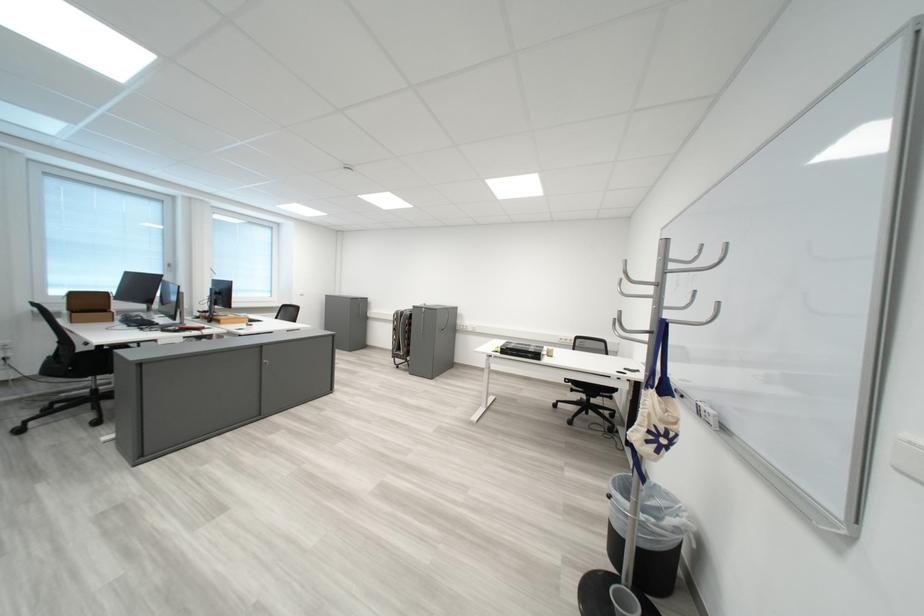
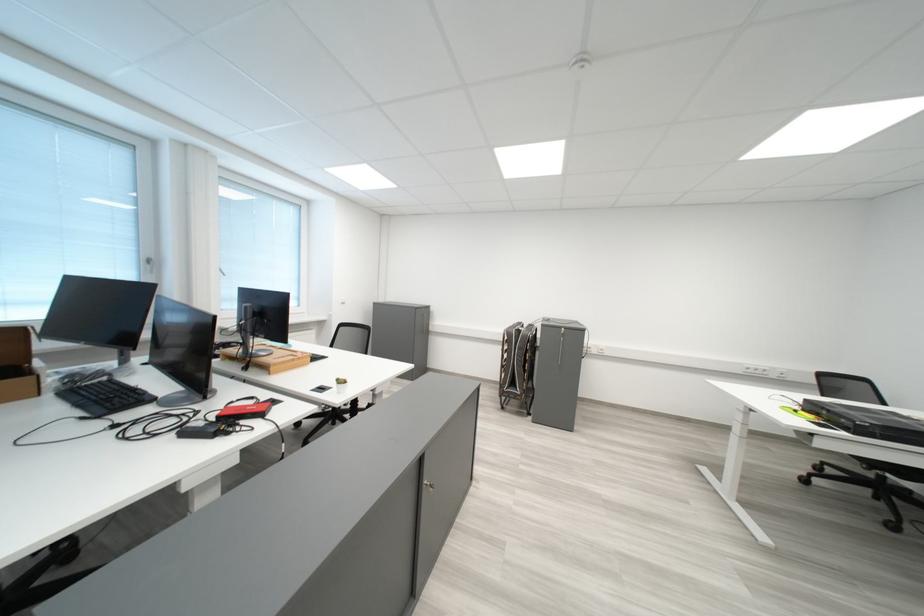
Locate, in the second image, the point that corresponds to [177,333] in the first image.

(200, 436)